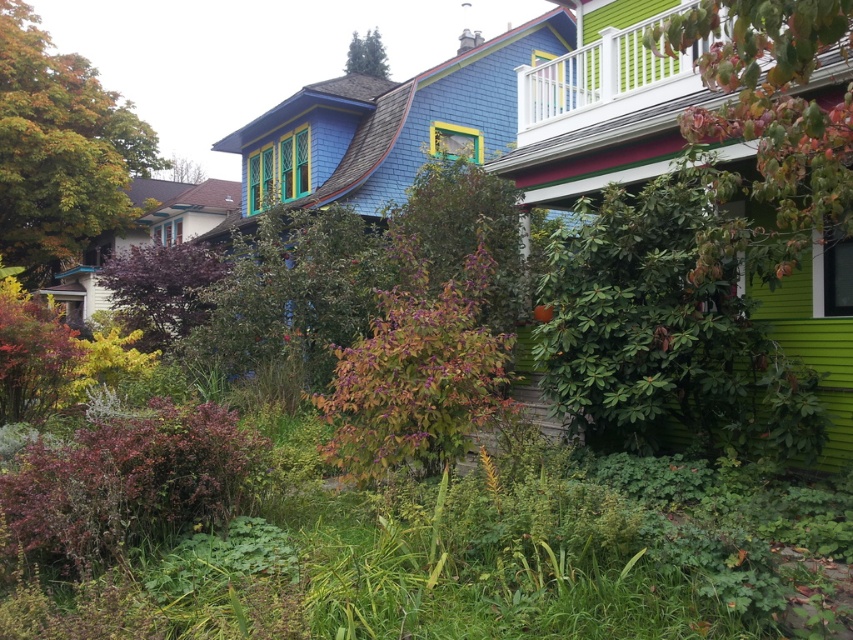
You are a drone operator planning to fly a drone between the green matte leaves at upper right and the brown wood tree at upper left. The drone has a maximum flight distance of 25 meters. Can the drone safely complete the flight without exceeding its range?

The green matte leaves at upper right is 27.45 meters from brown wood tree at upper left. Since the drone has a maximum flight distance of 25 meters, it cannot safely complete the flight without exceeding its range.

From the picture: You are standing in the residential area and want to take a photo of the green leafy tree at center. If your camera has a maximum focus range of 8 meters, will you need to move closer or farther away to capture a clear image?

The green leafy tree at center is 8.25 meters away from the viewer. Since the camera can only focus up to 8 meters, you need to move closer to the tree to ensure it is within the camera range.